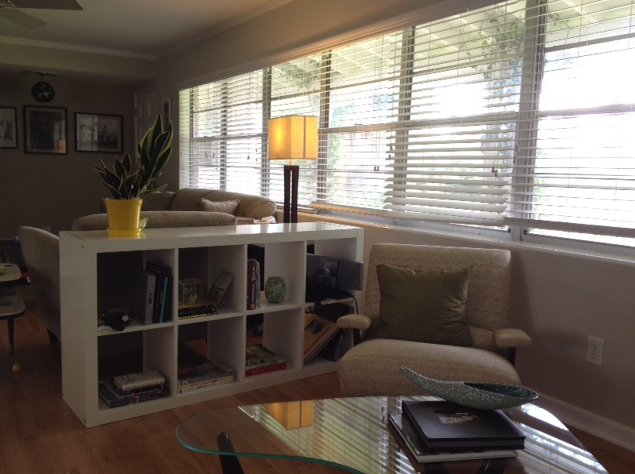
Where is `books on table`? This screenshot has height=474, width=635. books on table is located at coordinates (432, 424), (417, 446).